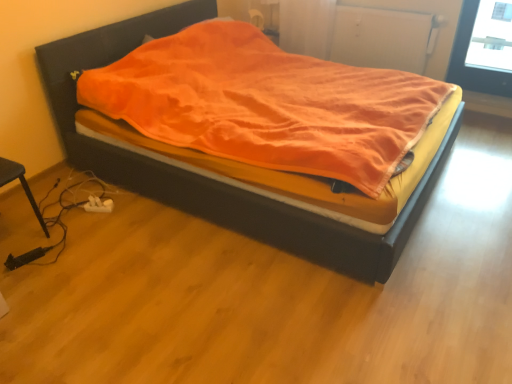
Where is `free space in front of velvet orange blanket at center`? The height and width of the screenshot is (384, 512). free space in front of velvet orange blanket at center is located at coordinates (257, 296).